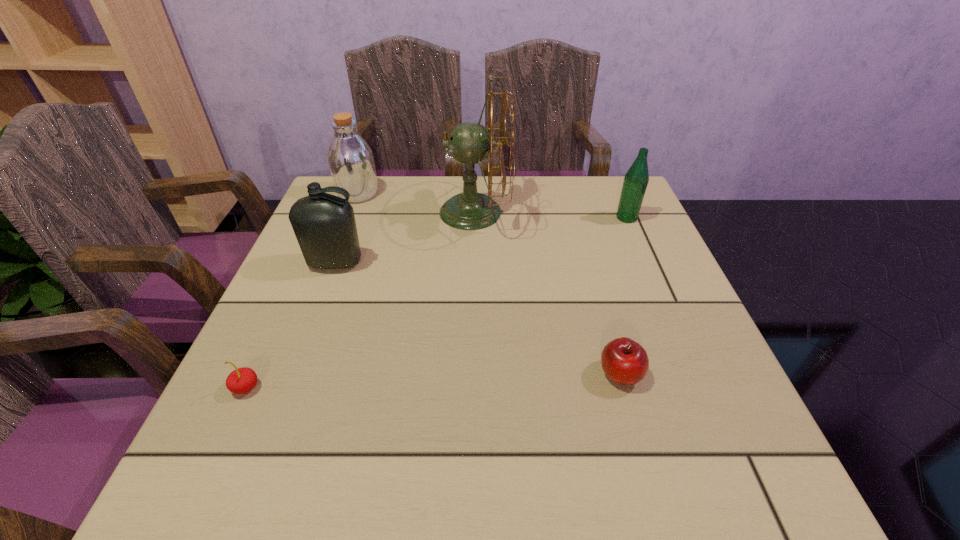
Locate an element on the screen. The height and width of the screenshot is (540, 960). vacant point that satisfies the following two spatial constraints: 1. on the back side of the second nearest bottle; 2. on the right side of the cherry is located at coordinates (324, 218).

In order to click on free space that satisfies the following two spatial constraints: 1. in front of the third object from right to left, directing air flow; 2. on the back side of the second nearest bottle in this screenshot , I will do `click(474, 218)`.

Where is `free space that satisfies the following two spatial constraints: 1. in front of the fan, directing air flow; 2. on the front side of the nearest bottle`? This screenshot has height=540, width=960. free space that satisfies the following two spatial constraints: 1. in front of the fan, directing air flow; 2. on the front side of the nearest bottle is located at coordinates click(473, 263).

Locate an element on the screen. The image size is (960, 540). free space that satisfies the following two spatial constraints: 1. in front of the apple, directing air flow; 2. on the left side of the fan is located at coordinates (471, 374).

The height and width of the screenshot is (540, 960). Find the location of `free space that satisfies the following two spatial constraints: 1. on the back side of the apple; 2. on the right side of the cherry`. free space that satisfies the following two spatial constraints: 1. on the back side of the apple; 2. on the right side of the cherry is located at coordinates (252, 374).